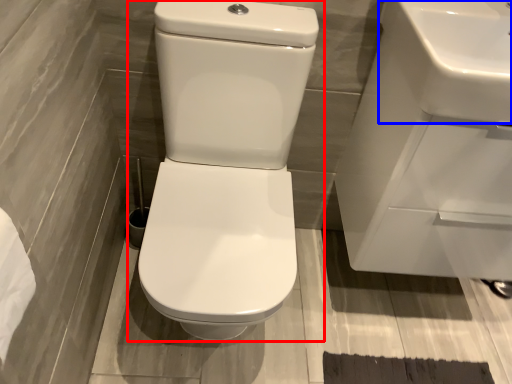
Question: Which object appears closest to the camera in this image, toilet (highlighted by a red box) or sink (highlighted by a blue box)?

Choices:
 (A) toilet
 (B) sink

Answer: (A)